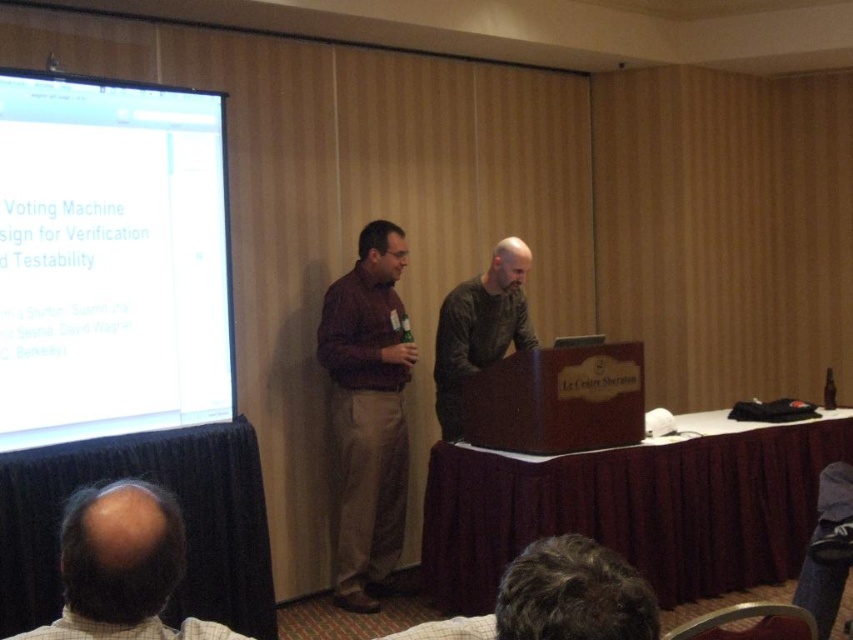
Does white glossy projector screen at upper left appear over bald head at lower left?

Yes.

Who is positioned more to the right, white glossy projector screen at upper left or bald head at lower left?

Positioned to the right is bald head at lower left.

Measure the distance between point (78,193) and camera.

Point (78,193) is 3.06 meters from camera.

The width and height of the screenshot is (853, 640). Find the location of `white glossy projector screen at upper left`. white glossy projector screen at upper left is located at coordinates (111, 259).

Is white glossy projector screen at upper left above matte brown shirt at center?

Yes, white glossy projector screen at upper left is above matte brown shirt at center.

Who is shorter, white glossy projector screen at upper left or matte brown shirt at center?

white glossy projector screen at upper left

What do you see at coordinates (111, 259) in the screenshot?
I see `white glossy projector screen at upper left` at bounding box center [111, 259].

Image resolution: width=853 pixels, height=640 pixels. I want to click on white glossy projector screen at upper left, so (111, 259).

Is matte brown shirt at center to the left of dark green sweater at center from the viewer's perspective?

Indeed, matte brown shirt at center is positioned on the left side of dark green sweater at center.

Between matte brown shirt at center and dark green sweater at center, which one has more height?

With more height is matte brown shirt at center.

Is point (370, 282) closer to camera compared to point (495, 352)?

Yes, it is.

I want to click on matte brown shirt at center, so click(x=367, y=412).